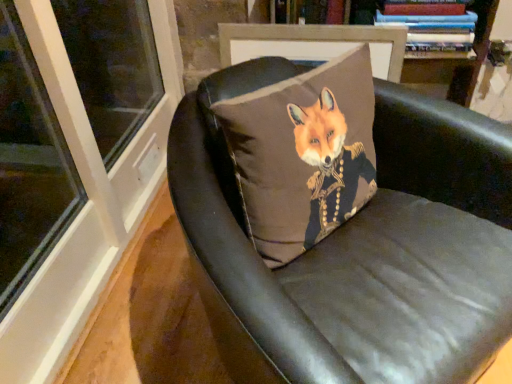
Question: Is hardcover books at upper right oriented away from leather cushion at center?

Choices:
 (A) no
 (B) yes

Answer: (A)

Question: Considering the relative sizes of hardcover books at upper right and leather cushion at center in the image provided, is hardcover books at upper right smaller than leather cushion at center?

Choices:
 (A) no
 (B) yes

Answer: (B)

Question: Would you say hardcover books at upper right is outside leather cushion at center?

Choices:
 (A) yes
 (B) no

Answer: (A)

Question: From the image's perspective, is hardcover books at upper right over leather cushion at center?

Choices:
 (A) yes
 (B) no

Answer: (A)

Question: From a real-world perspective, is hardcover books at upper right positioned over leather cushion at center based on gravity?

Choices:
 (A) no
 (B) yes

Answer: (B)

Question: From the image's perspective, is leather cushion at center above or below matte brown pillow with fox design at center?

Choices:
 (A) above
 (B) below

Answer: (B)

Question: Looking at their shapes, would you say leather cushion at center is wider or thinner than matte brown pillow with fox design at center?

Choices:
 (A) wide
 (B) thin

Answer: (A)

Question: From a real-world perspective, is leather cushion at center above or below matte brown pillow with fox design at center?

Choices:
 (A) above
 (B) below

Answer: (B)

Question: In the image, is leather cushion at center on the left side or the right side of matte brown pillow with fox design at center?

Choices:
 (A) right
 (B) left

Answer: (A)

Question: Considering their positions, is matte brown pillow with fox design at center located in front of or behind hardcover books at upper right?

Choices:
 (A) front
 (B) behind

Answer: (A)

Question: From the image's perspective, is matte brown pillow with fox design at center positioned above or below hardcover books at upper right?

Choices:
 (A) above
 (B) below

Answer: (B)

Question: Considering the positions of matte brown pillow with fox design at center and hardcover books at upper right in the image, is matte brown pillow with fox design at center taller or shorter than hardcover books at upper right?

Choices:
 (A) tall
 (B) short

Answer: (A)

Question: From a real-world perspective, is matte brown pillow with fox design at center above or below hardcover books at upper right?

Choices:
 (A) below
 (B) above

Answer: (A)

Question: From the image's perspective, is matte brown pillow with fox design at center located above or below leather cushion at center?

Choices:
 (A) below
 (B) above

Answer: (B)

Question: Does point (x=244, y=125) appear closer or farther from the camera than point (x=330, y=251)?

Choices:
 (A) closer
 (B) farther

Answer: (A)